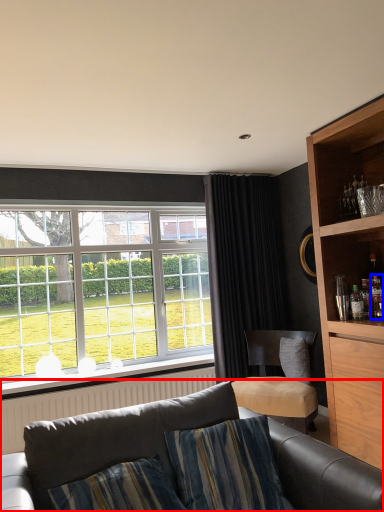
Question: Among these objects, which one is nearest to the camera, studio couch (highlighted by a red box) or bottle (highlighted by a blue box)?

Choices:
 (A) studio couch
 (B) bottle

Answer: (A)